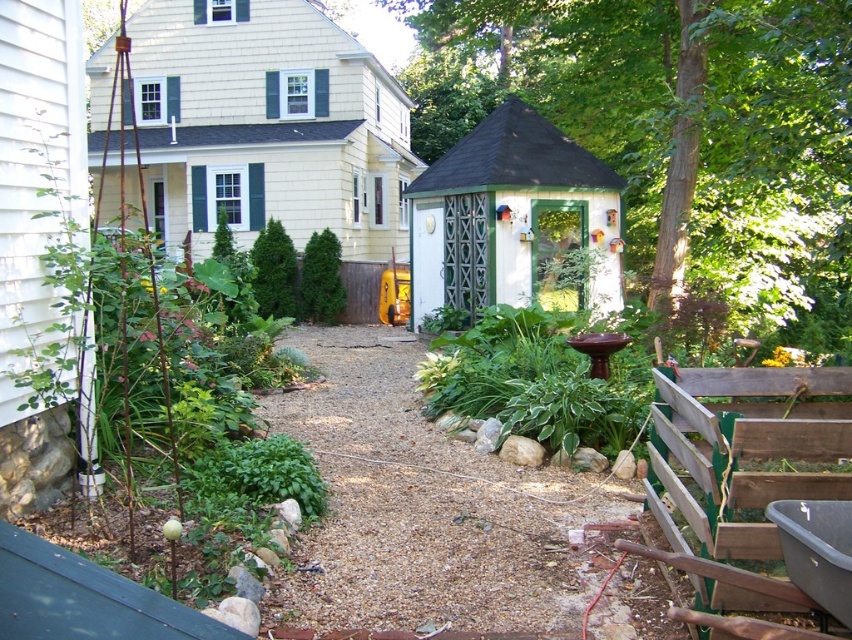
Based on the photo, you are planning to install a new sprinkler system in the backyard. The sprinkler has a maximum range of 25 feet. Based on the image, will the sprinkler be able to water both the white painted wood gazebo at center and the green leafy shrub at center?

The distance between the white painted wood gazebo at center and the green leafy shrub at center is 27.87 feet, which exceeds the sprinkler system maximum range of 25 feet. Therefore, the sprinkler will not be able to water both areas simultaneously.

You are standing in the backyard and want to walk to the shed. The shed is behind the brown gravel path at center. Can you walk directly to the shed without stepping on the path?

The brown gravel path at center is 13.14 feet away from you. Since the shed is behind the path, you would need to walk towards the path first before reaching the shed. Therefore, you cannot avoid stepping on the path if you want to reach the shed directly.